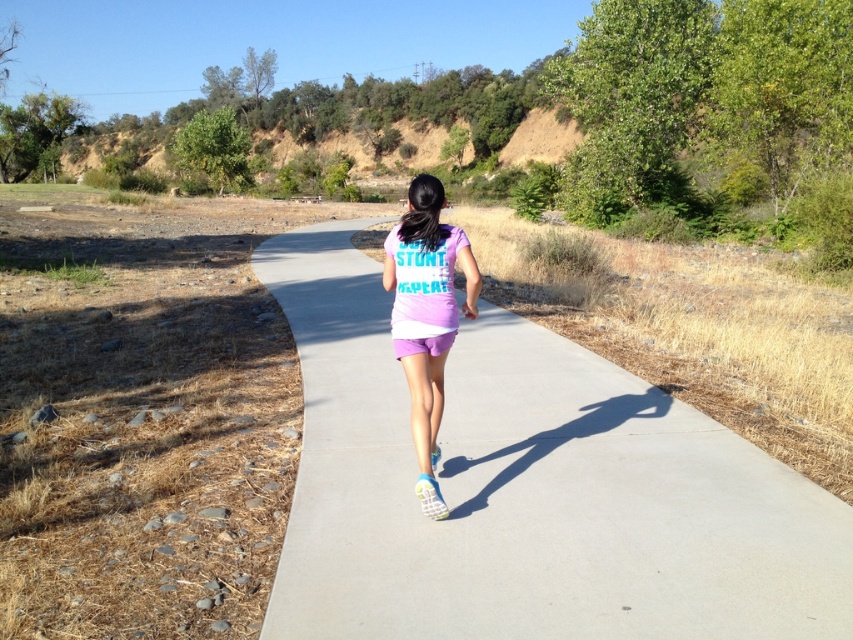
You are a photographer trying to capture the jogger in the scene. To get a clear shot of the purple matte shorts at center, should you aim your camera to the left or right of the smooth concrete pavement at center?

The smooth concrete pavement at center is positioned on the right side of purple matte shorts at center, so to capture the purple matte shorts at center, you should aim your camera to the left of the smooth concrete pavement at center.

You are a photographer aiming to capture the jogger in the image. To ensure the purple matte shorts at center are visible in the photo, should you focus your camera lens on the smooth concrete pavement at center or adjust the focus to a higher point?

The smooth concrete pavement at center is located below the purple matte shorts at center. To capture the purple matte shorts at center clearly, focus the camera lens on the higher point where the purple matte shorts at center are positioned rather than the lower smooth concrete pavement at center.